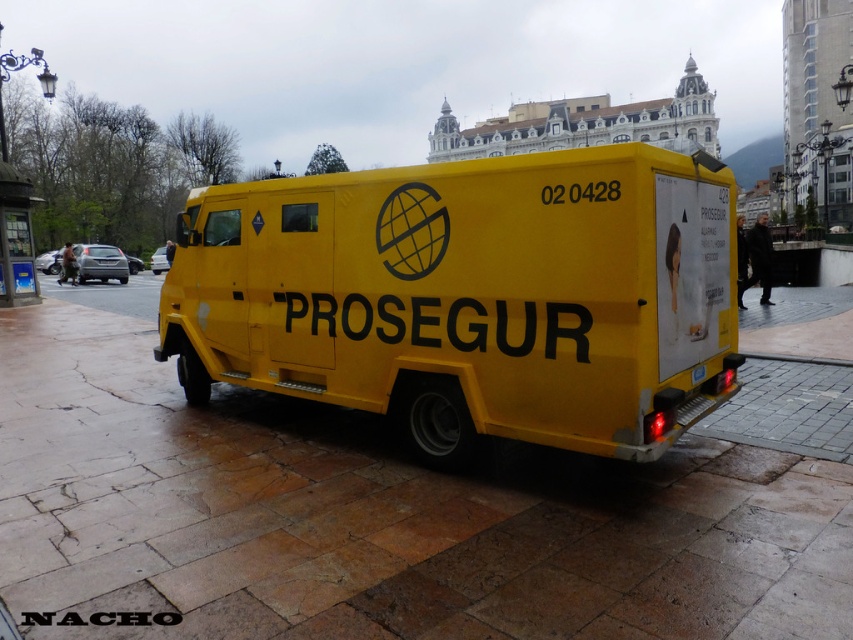
Does point (4, 451) come farther from viewer compared to point (555, 420)?

Yes, point (4, 451) is farther from viewer.

Is point (264, 408) closer to camera compared to point (577, 420)?

No, (264, 408) is further to viewer.

Identify the location of yellow concrete pavement at center. Image resolution: width=853 pixels, height=640 pixels. (374, 515).